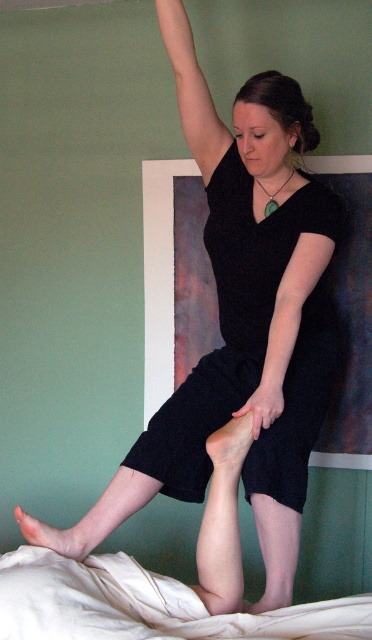
Between point (284, 244) and point (177, 35), which one is positioned in front?

Point (284, 244) is in front.

Does black textured dress at center appear over smooth skin arm at upper center?

No, black textured dress at center is not above smooth skin arm at upper center.

What do you see at coordinates (229, 323) in the screenshot?
I see `black textured dress at center` at bounding box center [229, 323].

Locate an element on the screen. black textured dress at center is located at coordinates (229, 323).

Which is in front, point (324, 412) or point (174, 582)?

Positioned in front is point (174, 582).

Is point (139, 452) closer to camera compared to point (155, 627)?

No, it is not.

This screenshot has width=372, height=640. In order to click on black textured dress at center in this screenshot , I will do `click(229, 323)`.

Is white fabric bed at lower left above black matte arm at center?

No, white fabric bed at lower left is not above black matte arm at center.

Does white fabric bed at lower left have a lesser width compared to black matte arm at center?

In fact, white fabric bed at lower left might be wider than black matte arm at center.

The height and width of the screenshot is (640, 372). Identify the location of white fabric bed at lower left. (145, 604).